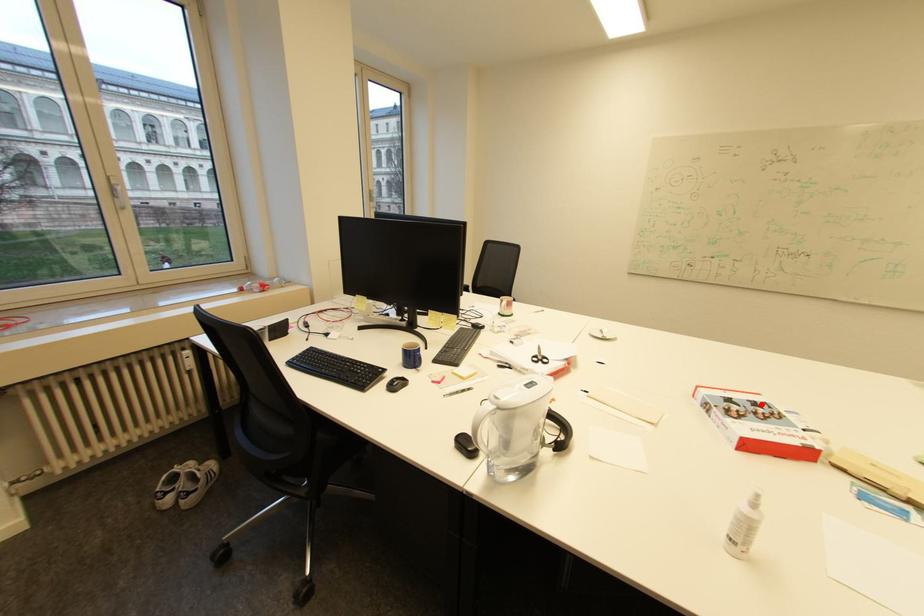
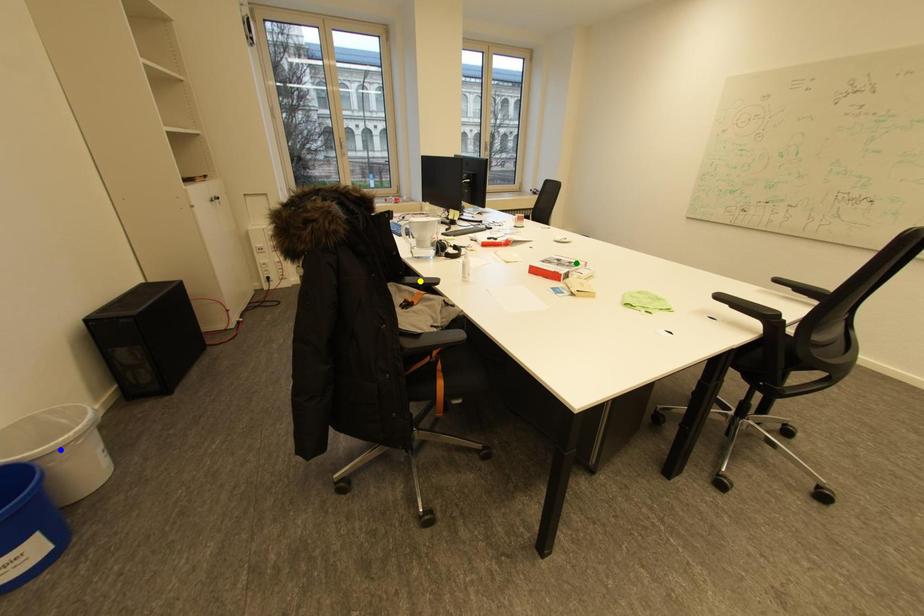
Question: I am providing you with two images of the same scene from different viewpoints. A red point is marked on the first image. You are given multiple points on the second image. In image 2, which mark is for the same physical point as the one in image 1?

Choices:
 (A) green point
 (B) blue point
 (C) yellow point

Answer: (A)